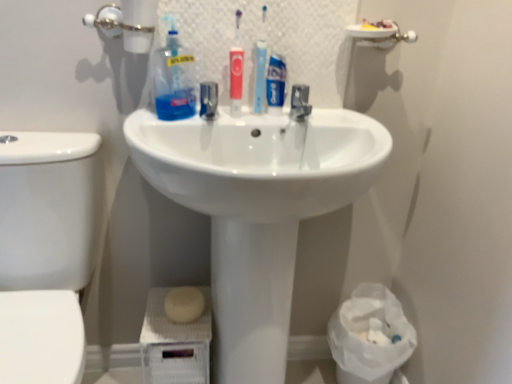
Question: Is metallic faucet at center wider than white plastic bag at lower right?

Choices:
 (A) no
 (B) yes

Answer: (A)

Question: Is metallic faucet at center smaller than white plastic bag at lower right?

Choices:
 (A) yes
 (B) no

Answer: (A)

Question: Is metallic faucet at center far away from white plastic bag at lower right?

Choices:
 (A) yes
 (B) no

Answer: (B)

Question: Is the depth of metallic faucet at center greater than that of white plastic bag at lower right?

Choices:
 (A) no
 (B) yes

Answer: (A)

Question: Is metallic faucet at center at the left side of white plastic bag at lower right?

Choices:
 (A) no
 (B) yes

Answer: (B)

Question: From the image's perspective, relative to transparent plastic toothbrushes at upper center, is white matte soap at lower center above or below?

Choices:
 (A) above
 (B) below

Answer: (B)

Question: From a real-world perspective, is white matte soap at lower center physically located above or below transparent plastic toothbrushes at upper center?

Choices:
 (A) below
 (B) above

Answer: (A)

Question: Is white matte soap at lower center inside or outside of transparent plastic toothbrushes at upper center?

Choices:
 (A) outside
 (B) inside

Answer: (A)

Question: Relative to transparent plastic toothbrushes at upper center, is white matte soap at lower center in front or behind?

Choices:
 (A) behind
 (B) front

Answer: (A)

Question: From the image's perspective, is metallic faucet at center located above or below white matte soap at lower center?

Choices:
 (A) below
 (B) above

Answer: (B)

Question: From a real-world perspective, relative to white matte soap at lower center, is metallic faucet at center vertically above or below?

Choices:
 (A) below
 (B) above

Answer: (B)

Question: Considering the positions of metallic faucet at center and white matte soap at lower center in the image, is metallic faucet at center taller or shorter than white matte soap at lower center?

Choices:
 (A) short
 (B) tall

Answer: (A)

Question: Based on their positions, is metallic faucet at center located to the left or right of white matte soap at lower center?

Choices:
 (A) right
 (B) left

Answer: (A)

Question: Is metallic faucet at center wider or thinner than white plastic bag at lower right?

Choices:
 (A) wide
 (B) thin

Answer: (B)

Question: From the image's perspective, is metallic faucet at center positioned above or below white plastic bag at lower right?

Choices:
 (A) above
 (B) below

Answer: (A)